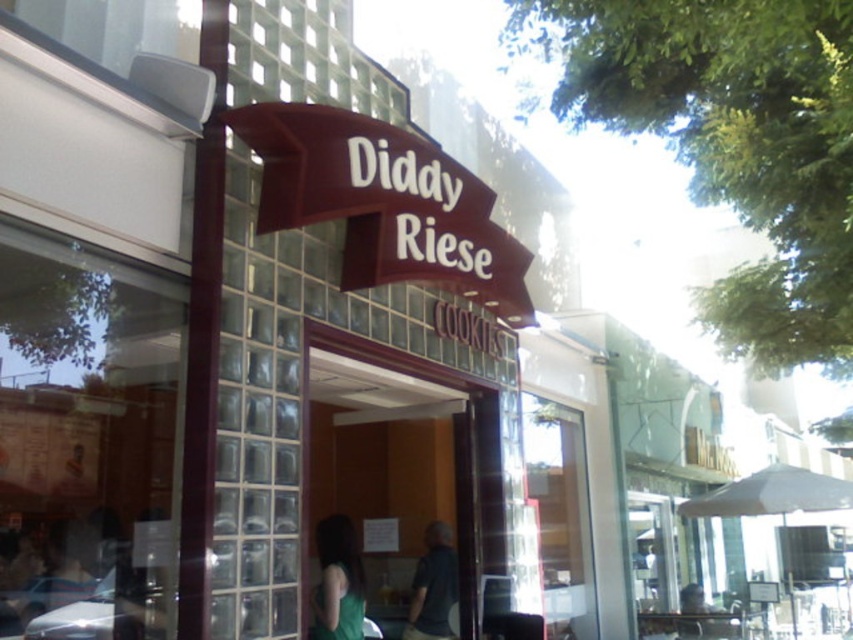
Who is more distant from viewer, (57, 605) or (428, 598)?

The point (428, 598) is more distant.

Is transparent glass door at left closer to camera compared to dark gray shirt at center?

Yes, transparent glass door at left is closer to the viewer.

Between point (148, 445) and point (456, 586), which one is positioned in front?

Positioned in front is point (148, 445).

Identify the location of transparent glass door at left. This screenshot has width=853, height=640. (86, 440).

Does transparent glass door at left have a greater height compared to transparent glass door at center?

Incorrect, transparent glass door at left's height is not larger of transparent glass door at center's.

Does point (32, 285) come in front of point (343, 490)?

Yes, point (32, 285) is in front of point (343, 490).

What do you see at coordinates (86, 440) in the screenshot? The image size is (853, 640). I see `transparent glass door at left` at bounding box center [86, 440].

Find the location of a particular element. The width and height of the screenshot is (853, 640). transparent glass door at left is located at coordinates (86, 440).

Does point (316, 547) lie in front of point (433, 620)?

Yes.

Locate an element on the screen. The width and height of the screenshot is (853, 640). green matte tank top at center is located at coordinates (338, 580).

Find the location of a particular element. This screenshot has height=640, width=853. green matte tank top at center is located at coordinates 338,580.